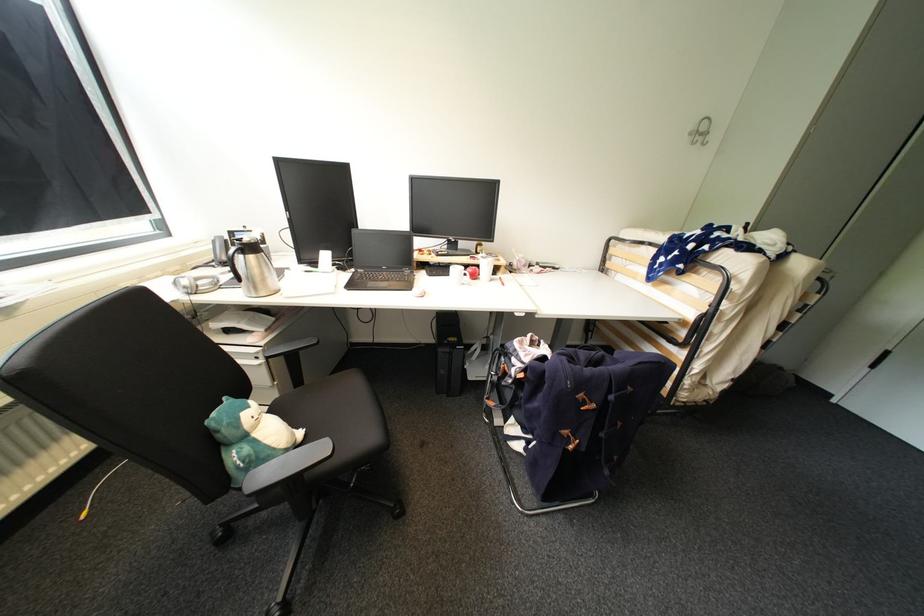
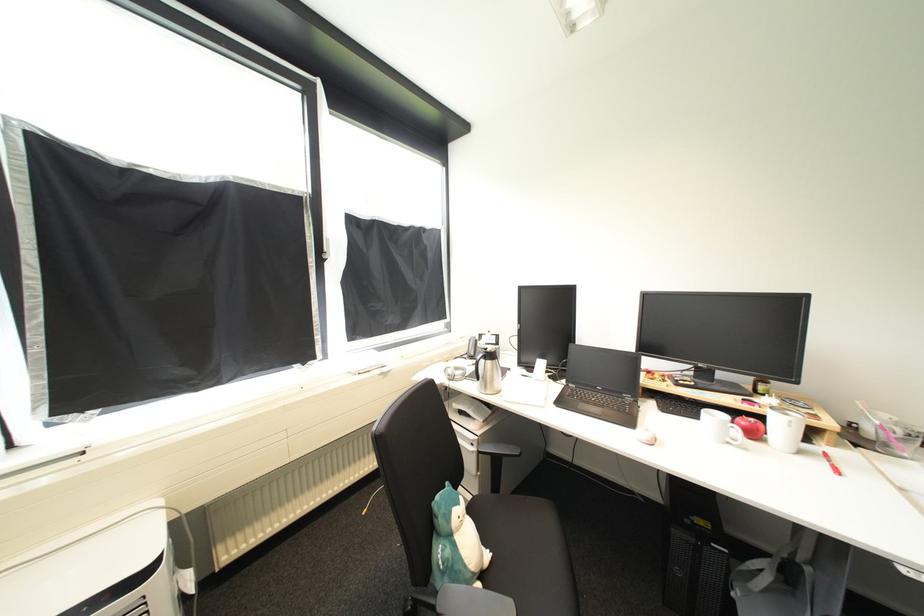
In the second image, find the point that corresponds to the point at 481,277 in the first image.

(761, 436)